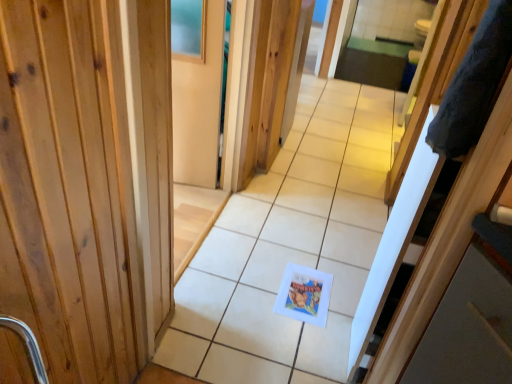
Question: Is gray fluffy robe at right at the left side of matte wood screen door at upper center?

Choices:
 (A) no
 (B) yes

Answer: (A)

Question: From a real-world perspective, does gray fluffy robe at right sit lower than matte wood screen door at upper center?

Choices:
 (A) no
 (B) yes

Answer: (A)

Question: Is gray fluffy robe at right directly adjacent to matte wood screen door at upper center?

Choices:
 (A) yes
 (B) no

Answer: (B)

Question: Can matte wood screen door at upper center be found inside gray fluffy robe at right?

Choices:
 (A) yes
 (B) no

Answer: (B)

Question: From the image's perspective, would you say gray fluffy robe at right is positioned over matte wood screen door at upper center?

Choices:
 (A) no
 (B) yes

Answer: (A)

Question: Do you think wooden at center is within matte wood screen door at upper center, or outside of it?

Choices:
 (A) outside
 (B) inside

Answer: (A)

Question: From a real-world perspective, is wooden at center above or below matte wood screen door at upper center?

Choices:
 (A) above
 (B) below

Answer: (A)

Question: Looking at the image, does wooden at center seem bigger or smaller compared to matte wood screen door at upper center?

Choices:
 (A) small
 (B) big

Answer: (B)

Question: Considering the positions of wooden at center and matte wood screen door at upper center in the image, is wooden at center taller or shorter than matte wood screen door at upper center?

Choices:
 (A) short
 (B) tall

Answer: (B)

Question: From a real-world perspective, is gray fluffy robe at right positioned above or below white paper at center?

Choices:
 (A) below
 (B) above

Answer: (B)

Question: In terms of height, does gray fluffy robe at right look taller or shorter compared to white paper at center?

Choices:
 (A) short
 (B) tall

Answer: (A)

Question: In terms of width, does gray fluffy robe at right look wider or thinner when compared to white paper at center?

Choices:
 (A) thin
 (B) wide

Answer: (B)

Question: Is point 499,9 positioned closer to the camera than point 355,206?

Choices:
 (A) farther
 (B) closer

Answer: (B)

Question: Considering the positions of white paper at center and wooden at center in the image, is white paper at center taller or shorter than wooden at center?

Choices:
 (A) short
 (B) tall

Answer: (B)

Question: From the image's perspective, relative to wooden at center, is white paper at center above or below?

Choices:
 (A) below
 (B) above

Answer: (A)